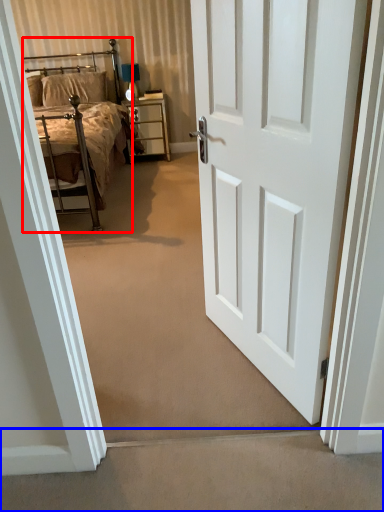
Question: Among these objects, which one is farthest to the camera, bed (highlighted by a red box) or stairwell (highlighted by a blue box)?

Choices:
 (A) bed
 (B) stairwell

Answer: (A)